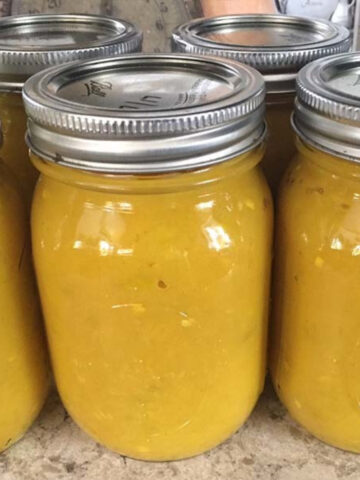
The image size is (360, 480). In order to click on glass in this screenshot , I will do `click(186, 268)`, `click(315, 263)`, `click(18, 390)`.